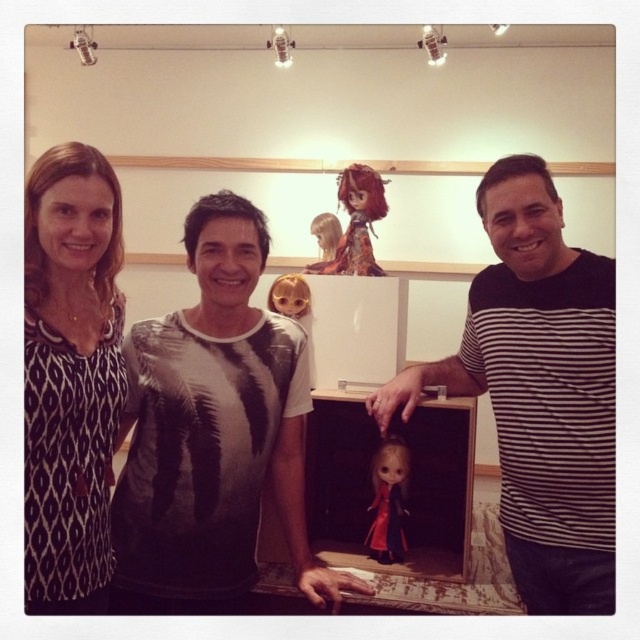
Question: Which of these objects is positioned closest to the matte black doll at center?

Choices:
 (A) printed cotton t-shirt at center
 (B) shiny golden doll at upper center

Answer: (A)

Question: Can you confirm if black striped shirt at right is positioned below matte black doll at center?

Choices:
 (A) yes
 (B) no

Answer: (B)

Question: From the image, what is the correct spatial relationship of shiny brown hair doll at upper center in relation to matte black doll at center?

Choices:
 (A) below
 (B) above

Answer: (B)

Question: Based on their relative distances, which object is farther from the printed cotton t-shirt at center?

Choices:
 (A) shiny brown hair doll at upper center
 (B) matte black doll at center

Answer: (A)

Question: Is black striped shirt at right to the left of black printed blouse at left from the viewer's perspective?

Choices:
 (A) yes
 (B) no

Answer: (B)

Question: Which object appears farthest from the camera in this image?

Choices:
 (A) matte black doll at center
 (B) shiny brown hair doll at upper center

Answer: (B)